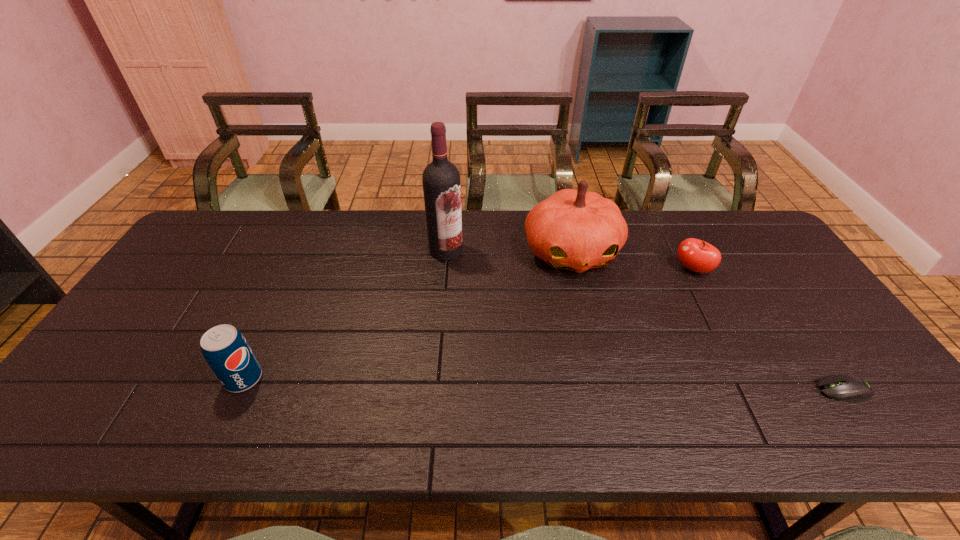
Locate an element on the screen. vacant region located 0.180m on the back of the pop is located at coordinates (276, 310).

What are the coordinates of `free location located 0.400m on the wheel side of the rightmost object` in the screenshot? It's located at (647, 390).

Image resolution: width=960 pixels, height=540 pixels. In order to click on vacant space located on the wheel side of the rightmost object in this screenshot , I will do `click(767, 390)`.

Image resolution: width=960 pixels, height=540 pixels. I want to click on vacant space located on the wheel side of the rightmost object, so click(x=741, y=390).

Where is `vacant position located on the label of the tallest object`? vacant position located on the label of the tallest object is located at coordinates (479, 299).

The height and width of the screenshot is (540, 960). Find the location of `vacant space located 0.090m on the label of the tallest object`. vacant space located 0.090m on the label of the tallest object is located at coordinates (465, 278).

Locate an element on the screen. This screenshot has height=540, width=960. free space located on the label of the tallest object is located at coordinates (514, 350).

Find the location of `free region located on the front-facing side of the fourth shortest object`. free region located on the front-facing side of the fourth shortest object is located at coordinates (597, 334).

At what (x,y) coordinates should I click in order to perform the action: click on vacant space located on the front-facing side of the fourth shortest object. Please return your answer as a coordinate pair (x, y). Looking at the image, I should click on (x=588, y=306).

Find the location of `blank area located on the front-facing side of the fourth shortest object`. blank area located on the front-facing side of the fourth shortest object is located at coordinates (609, 369).